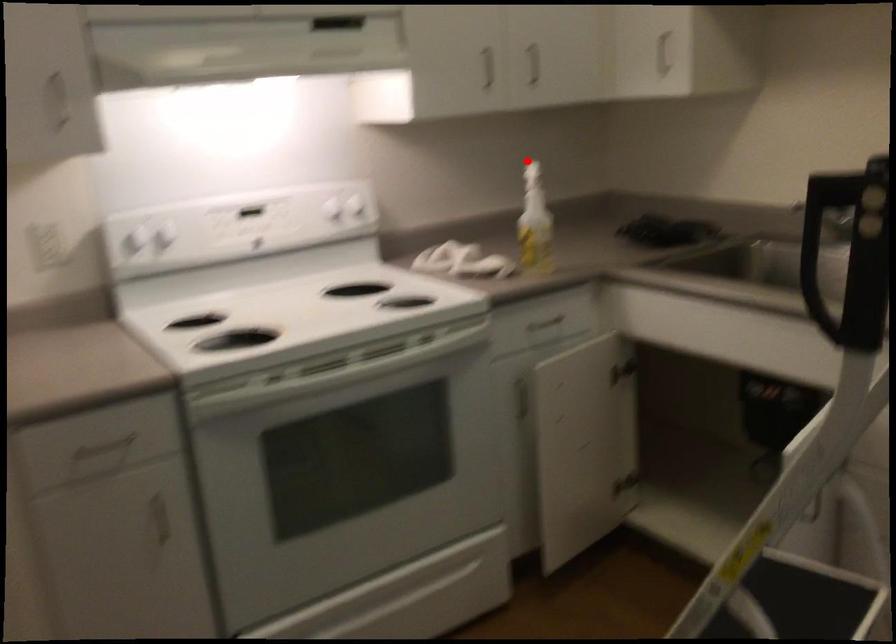
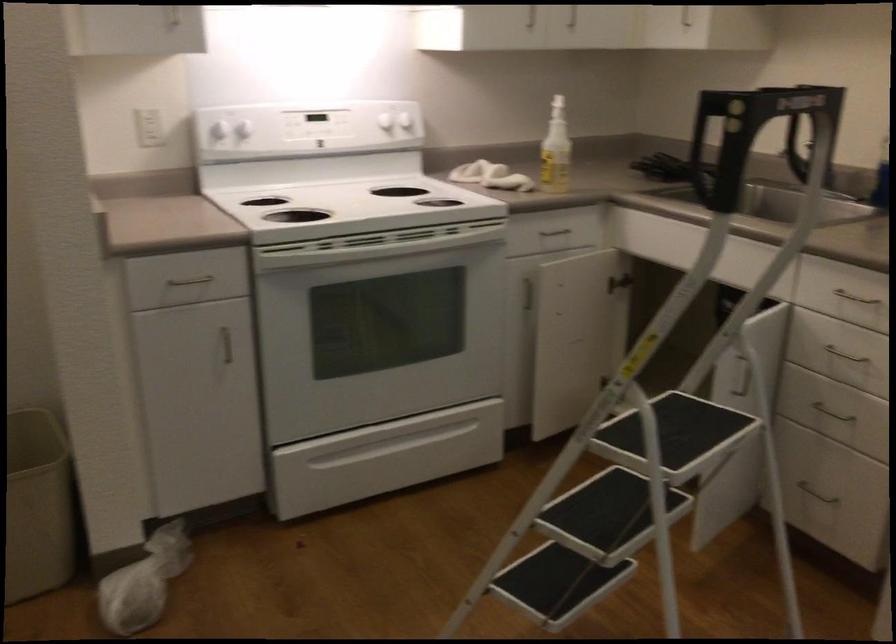
Question: I am providing you with two images of the same scene from different viewpoints. In image1, a red point is highlighted. Considering the same 3D point in image2, which of the following is correct?

Choices:
 (A) It is closer
 (B) It is farther

Answer: (B)